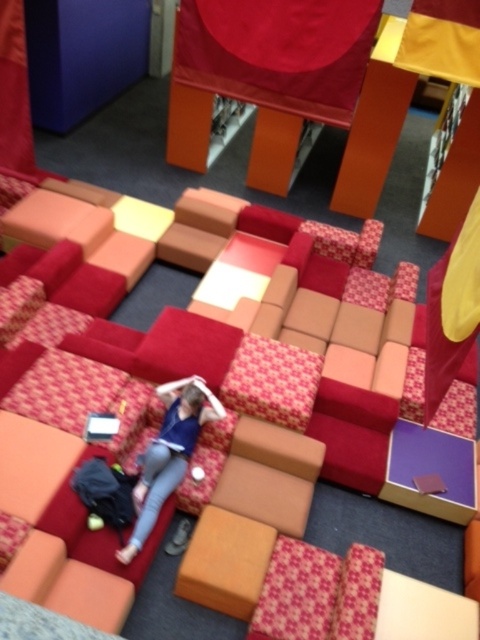
Question: Can you confirm if textured fabric couch at center is bigger than matte blue shirt at center?

Choices:
 (A) no
 (B) yes

Answer: (A)

Question: Is textured fabric couch at center to the right of matte blue shirt at center from the viewer's perspective?

Choices:
 (A) no
 (B) yes

Answer: (B)

Question: Which point is farther from the camera taking this photo?

Choices:
 (A) (213, 400)
 (B) (104, 307)

Answer: (B)

Question: Among these objects, which one is farthest from the camera?

Choices:
 (A) textured fabric couch at center
 (B) matte blue shirt at center

Answer: (A)

Question: Does textured fabric couch at center have a greater width compared to matte blue shirt at center?

Choices:
 (A) no
 (B) yes

Answer: (B)